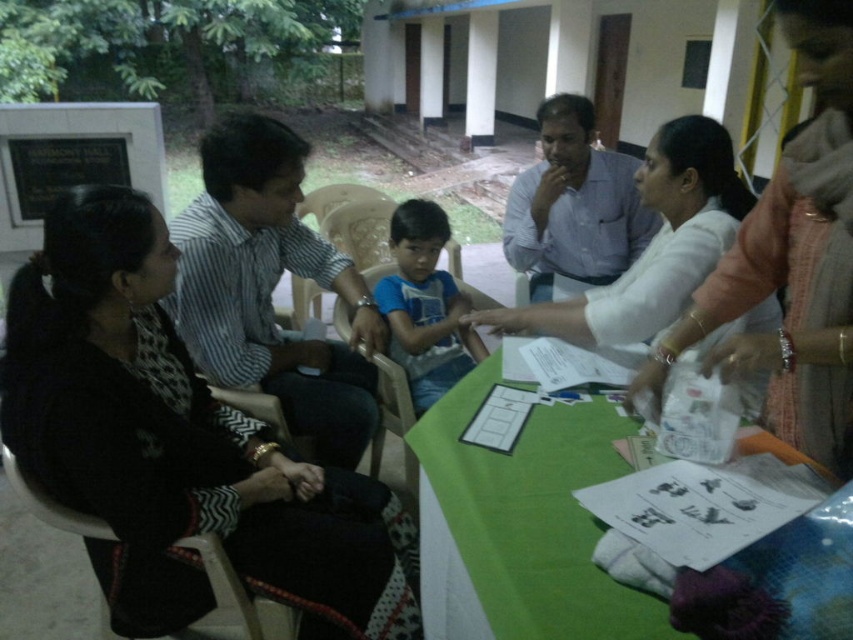
Based on the photo, does striped cotton shirt at center have a greater height compared to green fabric table at lower center?

Correct, striped cotton shirt at center is much taller as green fabric table at lower center.

Who is shorter, striped cotton shirt at center or green fabric table at lower center?

green fabric table at lower center is shorter.

Between point (299, 364) and point (787, 388), which one is positioned in front?

Point (787, 388) is more forward.

Locate an element on the screen. This screenshot has width=853, height=640. striped cotton shirt at center is located at coordinates click(270, 289).

Can you confirm if black fabric dress at left is positioned below striped cotton shirt at center?

Yes, black fabric dress at left is below striped cotton shirt at center.

Can you confirm if black fabric dress at left is positioned to the right of striped cotton shirt at center?

Incorrect, black fabric dress at left is not on the right side of striped cotton shirt at center.

What do you see at coordinates (178, 445) in the screenshot?
I see `black fabric dress at left` at bounding box center [178, 445].

You are a GUI agent. You are given a task and a screenshot of the screen. Output one action in this format:
    pyautogui.click(x=<x>, y=<y>)
    Task: Click on the black fabric dress at left
    This screenshot has width=853, height=640.
    Given the screenshot: What is the action you would take?
    pyautogui.click(x=178, y=445)

Is black fabric dress at left positioned in front of black fabric chair at lower left?

Yes.

Which is more to the right, black fabric dress at left or black fabric chair at lower left?

black fabric dress at left is more to the right.

Does point (160, 289) come in front of point (271, 602)?

Yes, point (160, 289) is closer to viewer.

You are a GUI agent. You are given a task and a screenshot of the screen. Output one action in this format:
    pyautogui.click(x=<x>, y=<y>)
    Task: Click on the black fabric dress at left
    
    Given the screenshot: What is the action you would take?
    pyautogui.click(x=178, y=445)